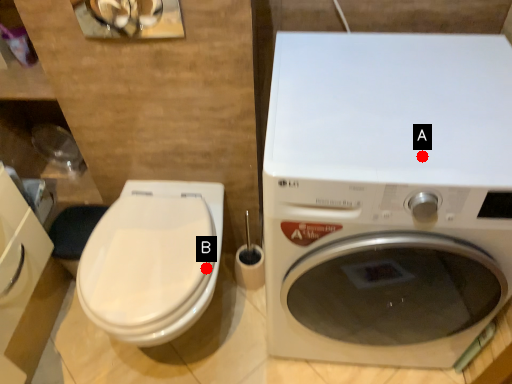
Question: Two points are circled on the image, labeled by A and B beside each circle. Which of the following is the closest to the observer?

Choices:
 (A) A is closer
 (B) B is closer

Answer: (A)